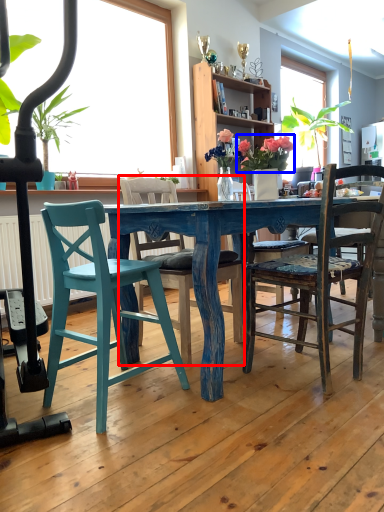
Question: Which point is closer to the camera, chair (highlighted by a red box) or floral arrangement (highlighted by a blue box)?

Choices:
 (A) chair
 (B) floral arrangement

Answer: (A)